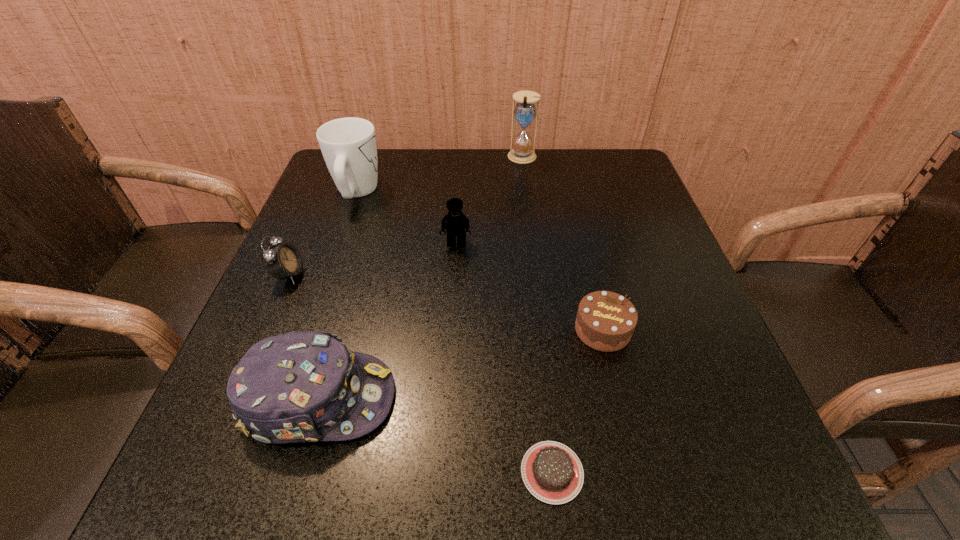
At what (x,y) coordinates should I click in order to perform the action: click on unoccupied position between the alarm clock and the mug. Please return your answer as a coordinate pair (x, y). Looking at the image, I should click on (323, 234).

I want to click on unoccupied area between the headwear and the farther chocolate cake, so click(x=461, y=364).

Where is `free space between the alarm clock and the rightmost object`? The width and height of the screenshot is (960, 540). free space between the alarm clock and the rightmost object is located at coordinates click(446, 302).

Find the location of a particular element. Image resolution: width=960 pixels, height=540 pixels. vacant space that's between the shorter chocolate cake and the third nearest object is located at coordinates (577, 401).

Find the location of `blank region between the headwear and the second farthest object`. blank region between the headwear and the second farthest object is located at coordinates (338, 295).

Find the location of a particular element. object identified as the third closest to the rightmost object is located at coordinates (297, 387).

Locate an element on the screen. The width and height of the screenshot is (960, 540). the sixth closest object relative to the headwear is located at coordinates (525, 111).

Where is `free space that satisfies the following two spatial constraints: 1. on the side of the second farthest object with the handle; 2. on the right side of the farthest object`? Image resolution: width=960 pixels, height=540 pixels. free space that satisfies the following two spatial constraints: 1. on the side of the second farthest object with the handle; 2. on the right side of the farthest object is located at coordinates (369, 158).

You are a GUI agent. You are given a task and a screenshot of the screen. Output one action in this format:
    pyautogui.click(x=<x>, y=<y>)
    Task: Click on the free space that satisfies the following two spatial constraints: 1. on the back side of the taller chocolate cake; 2. on the left side of the shortest object
    The image size is (960, 540).
    Given the screenshot: What is the action you would take?
    pyautogui.click(x=536, y=330)

The width and height of the screenshot is (960, 540). Find the location of `blank area in the image that satisfies the following two spatial constraints: 1. on the face of the farther chocolate cake; 2. on the right side of the third shortest object`. blank area in the image that satisfies the following two spatial constraints: 1. on the face of the farther chocolate cake; 2. on the right side of the third shortest object is located at coordinates (266, 330).